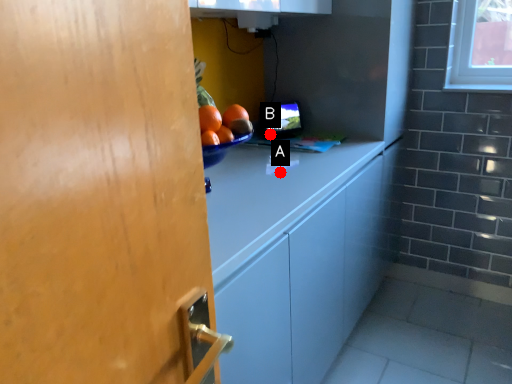
Question: Two points are circled on the image, labeled by A and B beside each circle. Which point is closer to the camera?

Choices:
 (A) A is closer
 (B) B is closer

Answer: (A)